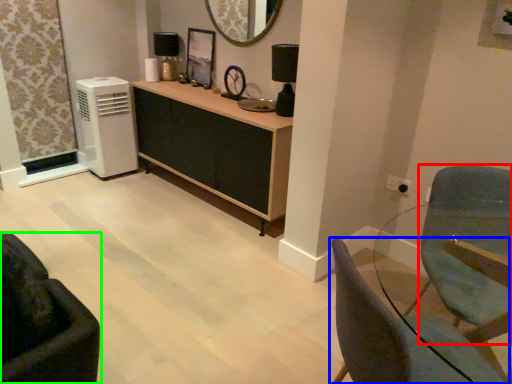
Question: Considering the real-world distances, which object is closest to swivel chair (highlighted by a red box)? chair (highlighted by a blue box) or chair (highlighted by a green box).

Choices:
 (A) chair
 (B) chair

Answer: (A)